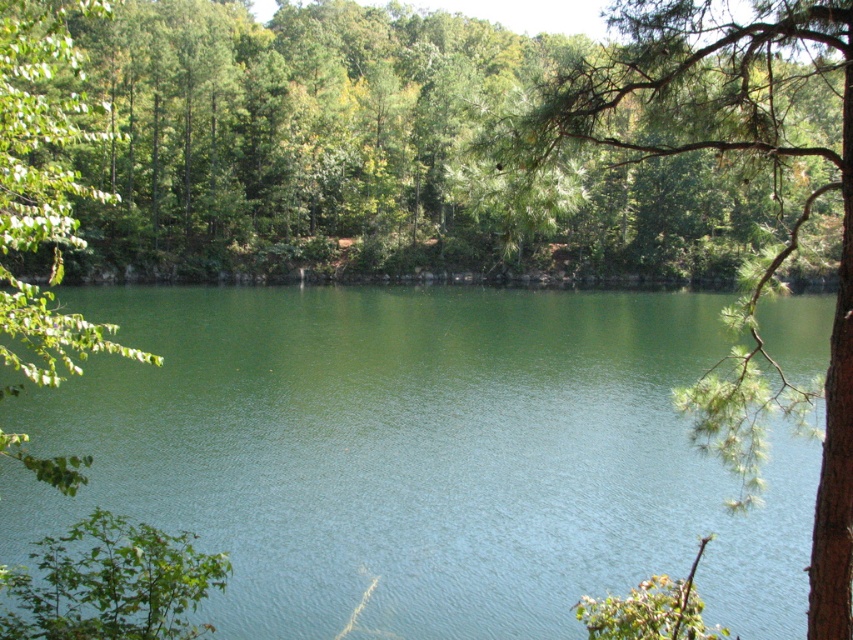
In the scene shown: You are an artist sketching the landscape and want to ensure accurate proportions. Which object in the scene takes up more space, the green liquid water at center or the green pine branch at upper right?

The green pine branch at upper right occupies more space than the green liquid water at center according to the description.

You are an artist trying to paint this scene. You need to decide which object to paint first based on their sizes. Which one should you start with, the green liquid water at center or the green pine branch at upper right?

The green liquid water at center is wider than the green pine branch at upper right, so you should start painting the green liquid water at center first because it is larger in width.